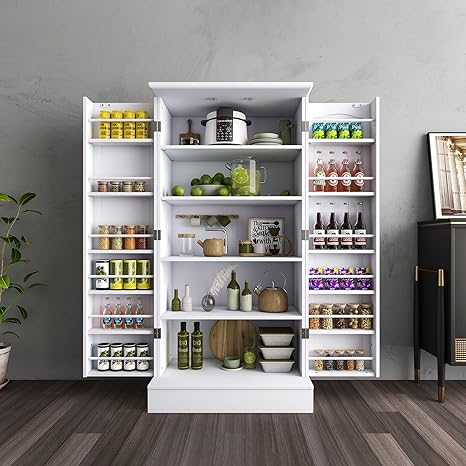
Where is `bottles with round label on shelf below top shelf on right side of cabinet`? bottles with round label on shelf below top shelf on right side of cabinet is located at coordinates (319, 184), (331, 184), (343, 180), (357, 180).